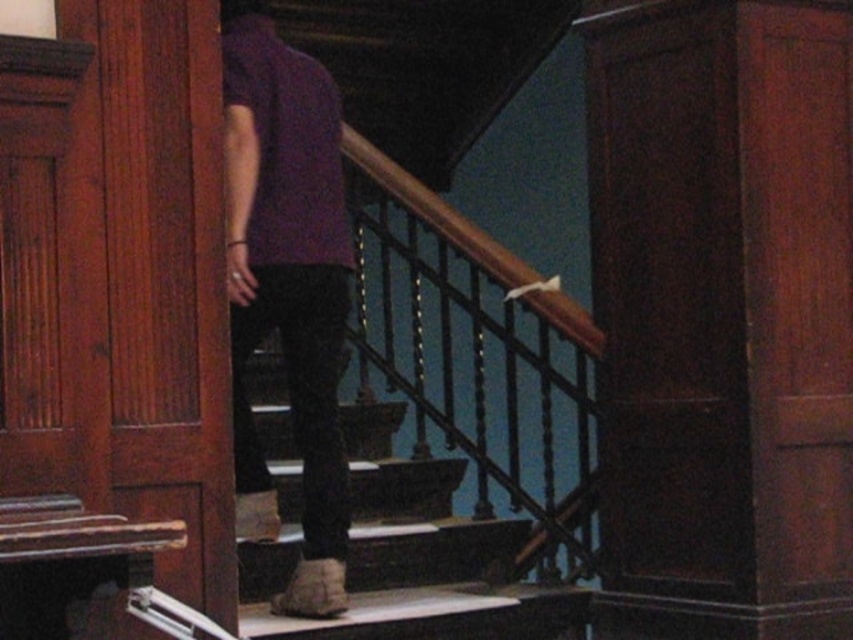
Question: Among these objects, which one is nearest to the camera?

Choices:
 (A) purple cotton shirt at center
 (B) wooden stairs at center
 (C) dark wood pillar at center

Answer: (A)

Question: Is dark wood pillar at center thinner than purple cotton shirt at center?

Choices:
 (A) no
 (B) yes

Answer: (A)

Question: Can you confirm if dark wood pillar at center is positioned to the left of wooden stairs at center?

Choices:
 (A) yes
 (B) no

Answer: (B)

Question: Can you confirm if dark wood pillar at center is positioned above wooden stairs at center?

Choices:
 (A) no
 (B) yes

Answer: (B)

Question: Which of the following is the closest to the observer?

Choices:
 (A) wooden stairs at center
 (B) purple cotton shirt at center
 (C) dark wood pillar at center

Answer: (B)

Question: Which of the following is the closest to the observer?

Choices:
 (A) (395, 468)
 (B) (294, 141)
 (C) (851, 477)

Answer: (B)